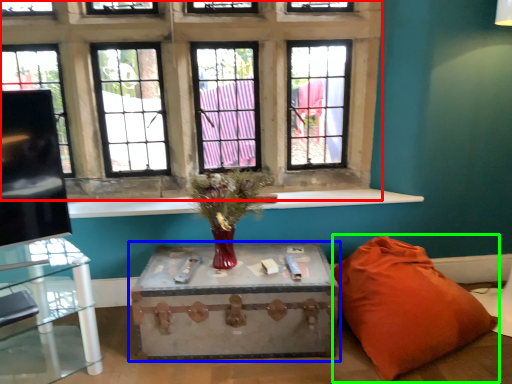
Question: Estimate the real-world distances between objects in this image. Which object is farther from window (highlighted by a red box), table (highlighted by a blue box) or pillow (highlighted by a green box)?

Choices:
 (A) table
 (B) pillow

Answer: (B)